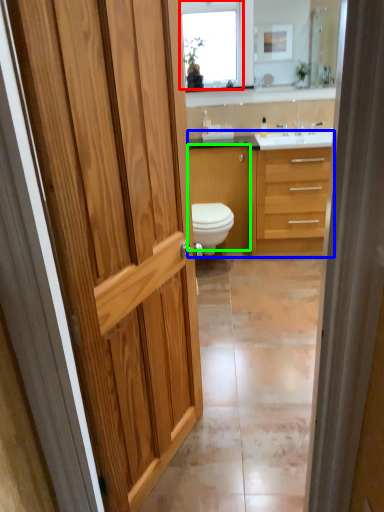
Question: Which is nearer to the window (highlighted by a red box)? bathroom cabinet (highlighted by a blue box) or cabinetry (highlighted by a green box).

Choices:
 (A) bathroom cabinet
 (B) cabinetry

Answer: (B)